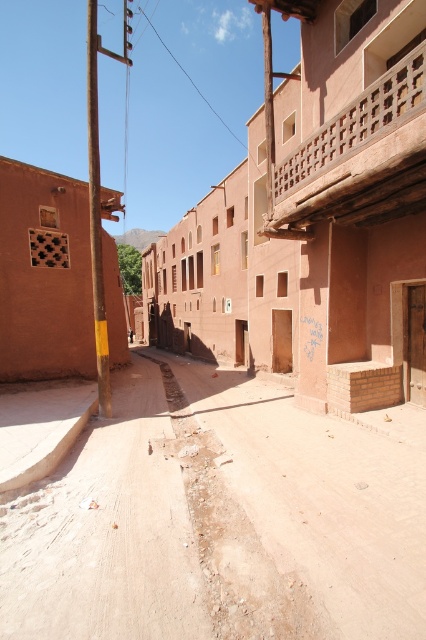
Between dull orange dirt at center and matte clay building at center, which one appears on the left side from the viewer's perspective?

From the viewer's perspective, dull orange dirt at center appears more on the left side.

Who is positioned more to the right, dull orange dirt at center or matte clay building at center?

matte clay building at center is more to the right.

Identify the location of dull orange dirt at center. This screenshot has height=640, width=426. (218, 520).

Where is `dull orange dirt at center`? dull orange dirt at center is located at coordinates (218, 520).

Does dull orange dirt at center have a greater height compared to dusty sand at center?

Indeed, dull orange dirt at center has a greater height compared to dusty sand at center.

What do you see at coordinates (218, 520) in the screenshot?
I see `dull orange dirt at center` at bounding box center [218, 520].

Between point (210, 592) and point (199, 525), which one is positioned behind?

The point (199, 525) is more distant.

Where is `dull orange dirt at center`? This screenshot has width=426, height=640. dull orange dirt at center is located at coordinates (218, 520).

Is matte clay building at center smaller than dusty sand at center?

No.

Which is behind, point (178, 317) or point (210, 452)?

The point (178, 317) is more distant.

This screenshot has width=426, height=640. Describe the element at coordinates (314, 220) in the screenshot. I see `matte clay building at center` at that location.

The height and width of the screenshot is (640, 426). Identify the location of matte clay building at center. (314, 220).